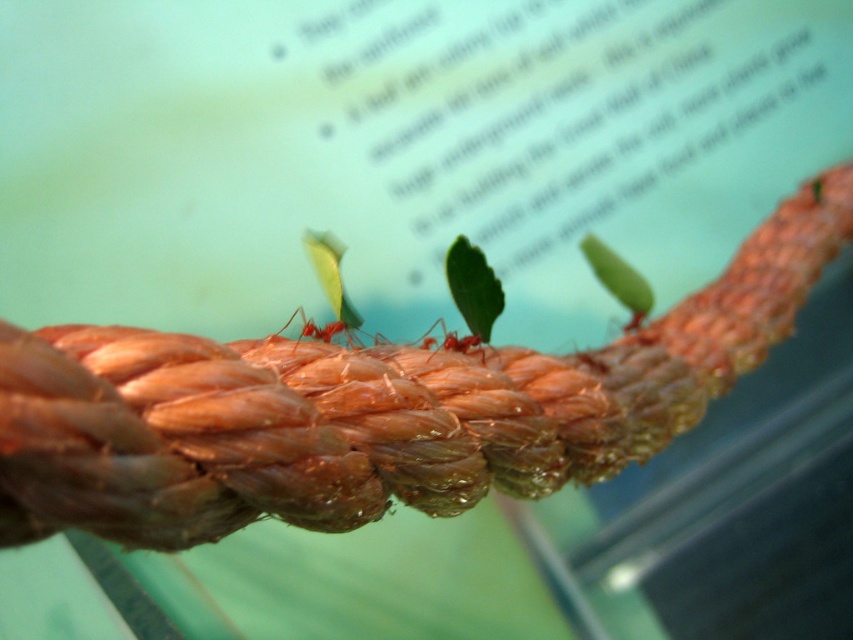
Can you confirm if matte red ant at center is positioned below red matte ant at center?

Incorrect, matte red ant at center is not positioned below red matte ant at center.

Is matte red ant at center taller than red matte ant at center?

Yes.

Where is `matte red ant at center`? This screenshot has height=640, width=853. matte red ant at center is located at coordinates (325, 326).